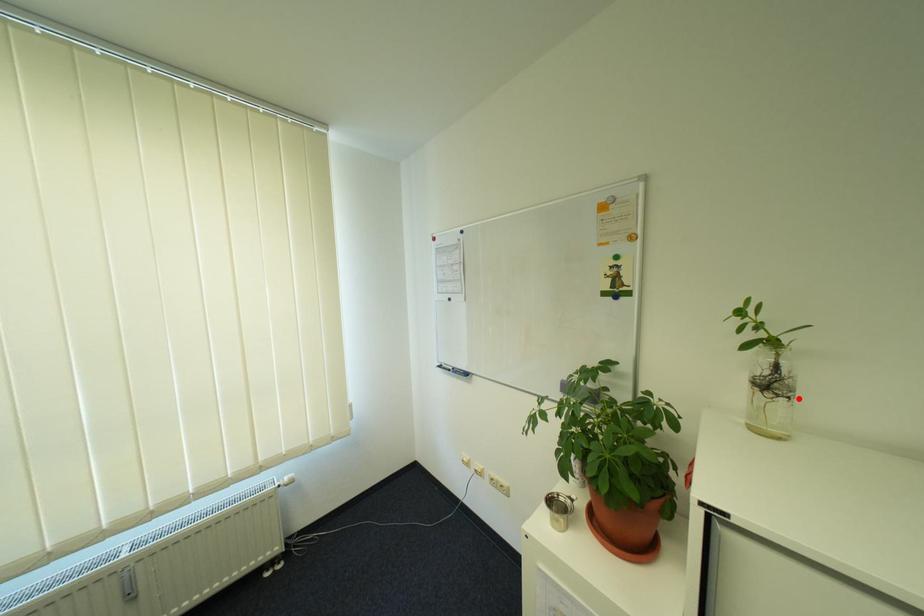
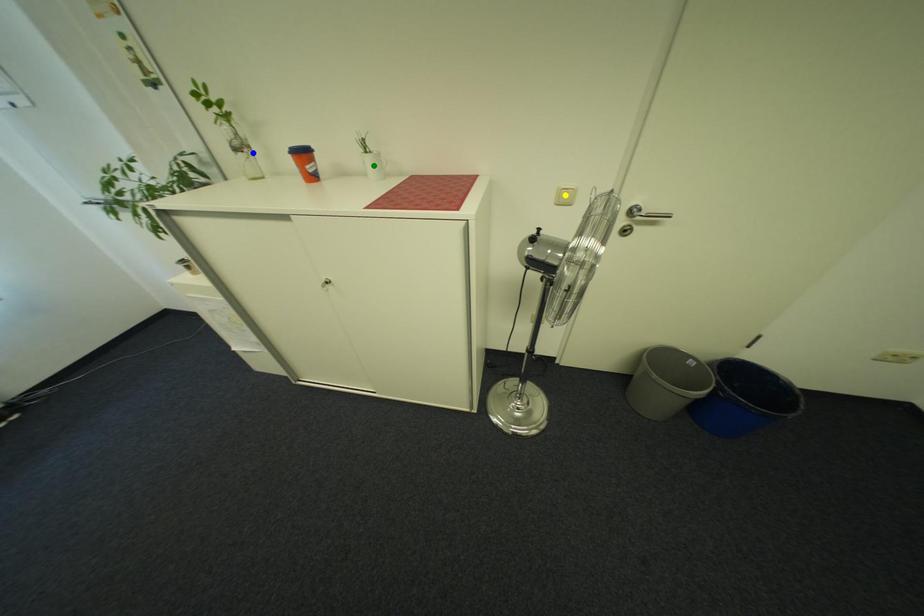
Question: I am providing you with two images of the same scene from different viewpoints. A red point is marked on the first image. You are given multiple points on the second image. Which point in image 2 is actually the same real-world point as the red point in image 1?

Choices:
 (A) green point
 (B) blue point
 (C) yellow point

Answer: (B)